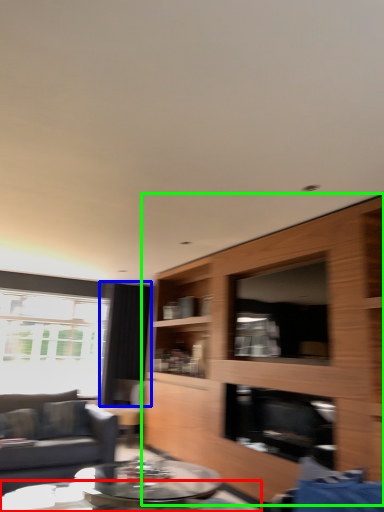
Question: Estimate the real-world distances between objects in this image. Which object is closer to coffee table (highlighted by a red box), curtain (highlighted by a blue box) or cabinetry (highlighted by a green box)?

Choices:
 (A) curtain
 (B) cabinetry

Answer: (B)